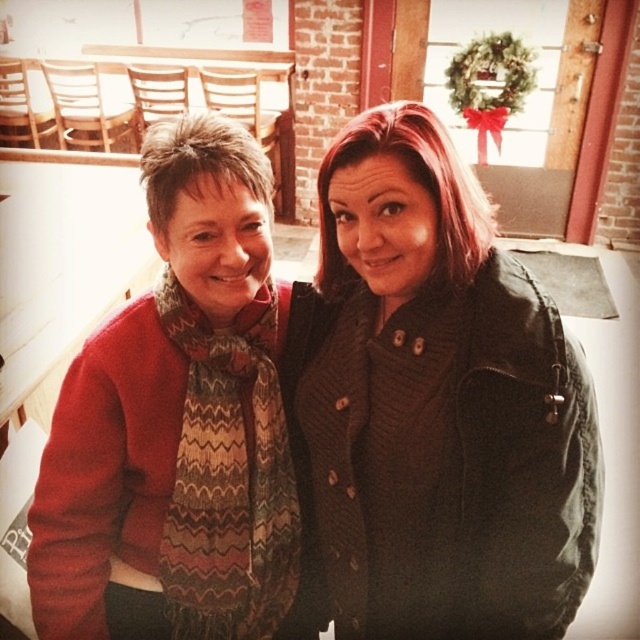
Question: Does matte black jacket at center have a smaller size compared to knitted scarf at left?

Choices:
 (A) no
 (B) yes

Answer: (B)

Question: Which of the following is the closest to the observer?

Choices:
 (A) (280, 584)
 (B) (362, 445)

Answer: (B)

Question: Which object is closer to the camera taking this photo?

Choices:
 (A) knitted scarf at left
 (B) matte black jacket at center

Answer: (B)

Question: Is matte black jacket at center bigger than knitted scarf at left?

Choices:
 (A) yes
 (B) no

Answer: (B)

Question: Is matte black jacket at center above knitted scarf at left?

Choices:
 (A) yes
 (B) no

Answer: (A)